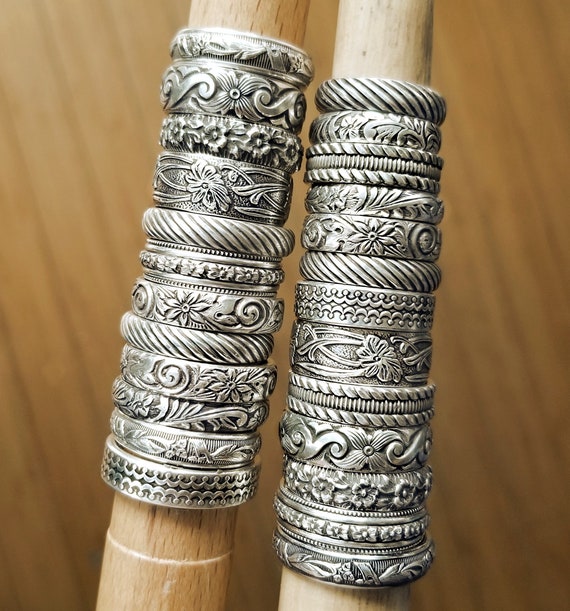
The height and width of the screenshot is (611, 570). I want to click on floor between, so [260, 532].